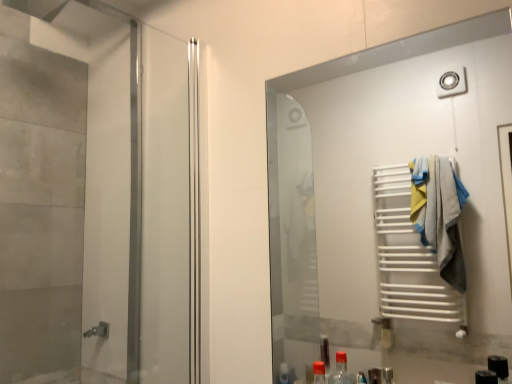
Question: Considering the positions of white matte towel rack at right and matte silver elevator at left in the image, is white matte towel rack at right wider or thinner than matte silver elevator at left?

Choices:
 (A) thin
 (B) wide

Answer: (A)

Question: Is white matte towel rack at right spatially inside matte silver elevator at left, or outside of it?

Choices:
 (A) inside
 (B) outside

Answer: (B)

Question: From the image's perspective, is white matte towel rack at right located above or below matte silver elevator at left?

Choices:
 (A) above
 (B) below

Answer: (B)

Question: Considering the positions of point (49, 119) and point (352, 129), is point (49, 119) closer or farther from the camera than point (352, 129)?

Choices:
 (A) farther
 (B) closer

Answer: (B)

Question: Considering the positions of matte silver elevator at left and white matte towel rack at right in the image, is matte silver elevator at left wider or thinner than white matte towel rack at right?

Choices:
 (A) wide
 (B) thin

Answer: (A)

Question: Based on their sizes in the image, would you say matte silver elevator at left is bigger or smaller than white matte towel rack at right?

Choices:
 (A) big
 (B) small

Answer: (A)

Question: From the image's perspective, is matte silver elevator at left located above or below white matte towel rack at right?

Choices:
 (A) below
 (B) above

Answer: (B)